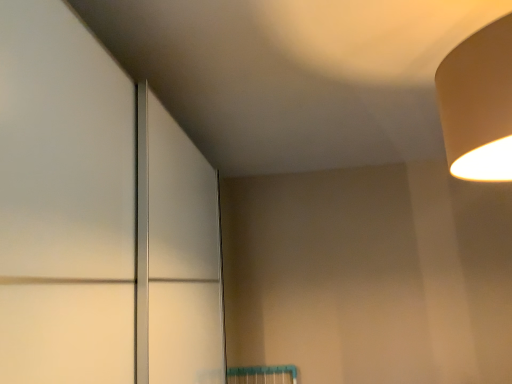
Question: Is matte white door at center touching beige matte lampshade at upper right?

Choices:
 (A) yes
 (B) no

Answer: (B)

Question: Is matte white door at center not close to beige matte lampshade at upper right?

Choices:
 (A) no
 (B) yes

Answer: (A)

Question: Does matte white door at center have a smaller size compared to beige matte lampshade at upper right?

Choices:
 (A) no
 (B) yes

Answer: (A)

Question: Considering the relative sizes of matte white door at center and beige matte lampshade at upper right in the image provided, is matte white door at center wider than beige matte lampshade at upper right?

Choices:
 (A) no
 (B) yes

Answer: (B)

Question: Is matte white door at center shorter than beige matte lampshade at upper right?

Choices:
 (A) yes
 (B) no

Answer: (B)

Question: Is matte white door at center positioned beyond the bounds of beige matte lampshade at upper right?

Choices:
 (A) yes
 (B) no

Answer: (A)

Question: Is beige matte lampshade at upper right closer to the viewer compared to matte white door at center?

Choices:
 (A) yes
 (B) no

Answer: (B)

Question: Considering the relative sizes of beige matte lampshade at upper right and matte white door at center in the image provided, is beige matte lampshade at upper right wider than matte white door at center?

Choices:
 (A) no
 (B) yes

Answer: (A)

Question: From the image's perspective, does beige matte lampshade at upper right appear higher than matte white door at center?

Choices:
 (A) yes
 (B) no

Answer: (A)

Question: Does beige matte lampshade at upper right have a lesser width compared to matte white door at center?

Choices:
 (A) yes
 (B) no

Answer: (A)

Question: Is beige matte lampshade at upper right positioned far away from matte white door at center?

Choices:
 (A) yes
 (B) no

Answer: (B)

Question: Is matte white door at center at the back of beige matte lampshade at upper right?

Choices:
 (A) yes
 (B) no

Answer: (B)

Question: From the image's perspective, is matte white door at center positioned above or below beige matte lampshade at upper right?

Choices:
 (A) below
 (B) above

Answer: (A)